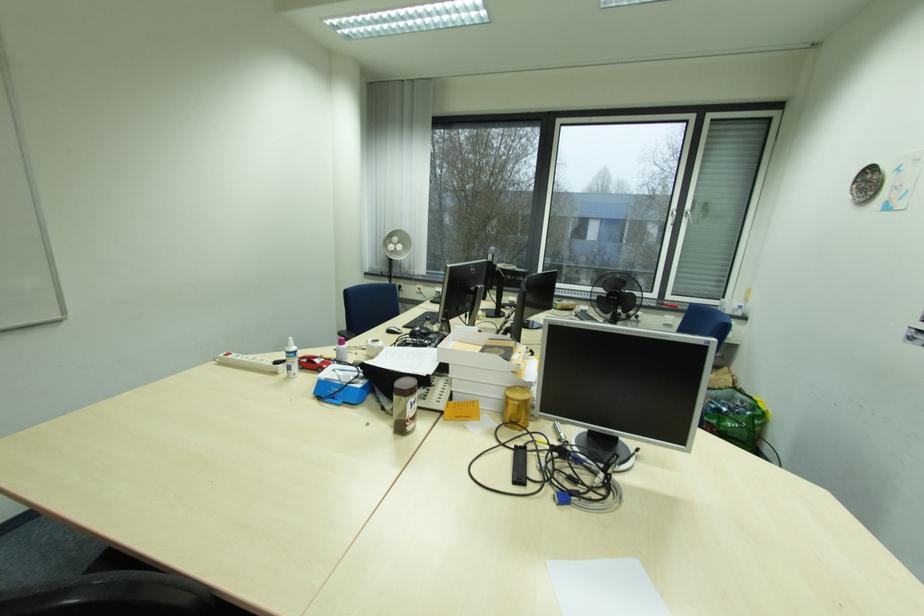
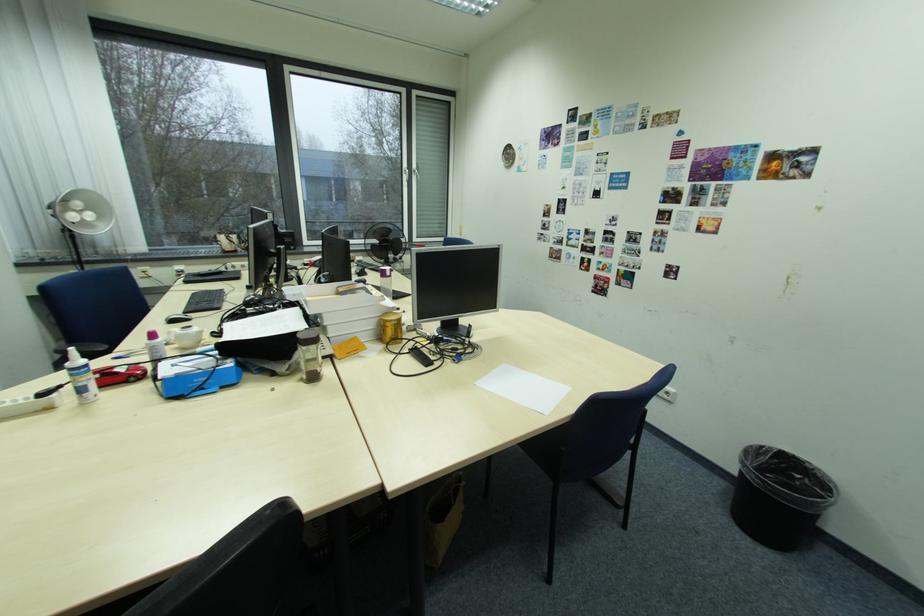
Locate, in the second image, the point that corresponds to (x=521, y=421) in the first image.

(400, 339)